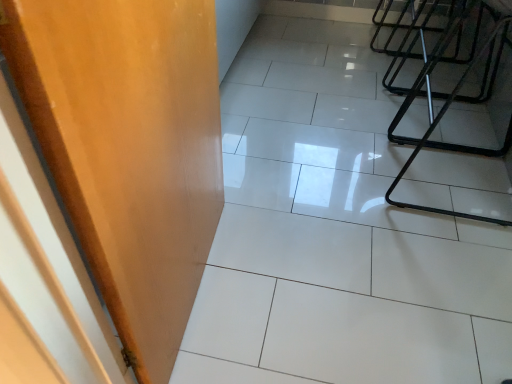
The width and height of the screenshot is (512, 384). Find the location of `unoccupied space behind wooden door at left`. unoccupied space behind wooden door at left is located at coordinates (262, 194).